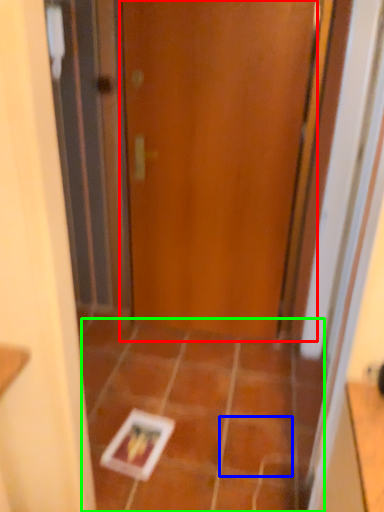
Question: Which object is positioned farthest from door (highlighted by a red box)? Select from ceramic tile (highlighted by a blue box) and ceramic tile (highlighted by a green box).

Choices:
 (A) ceramic tile
 (B) ceramic tile

Answer: (A)